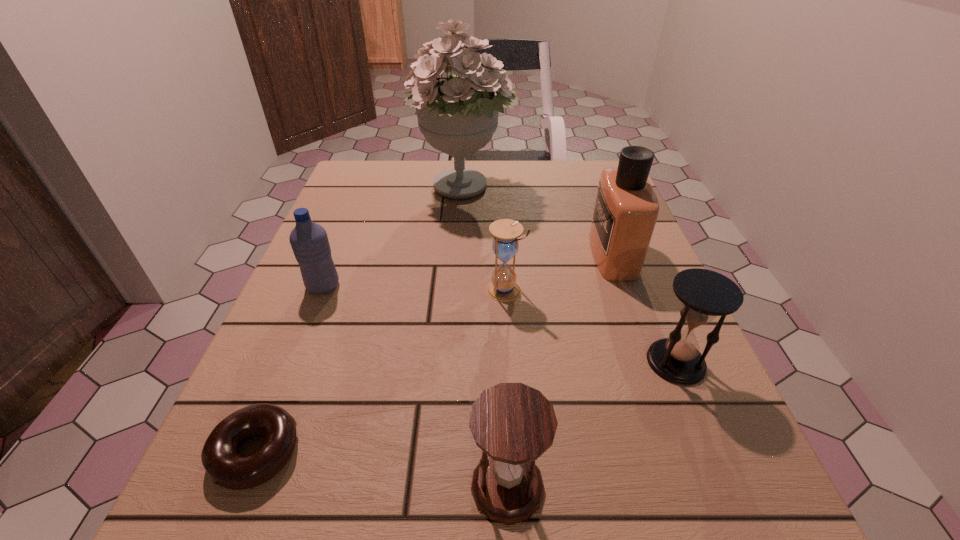
Where is `vacant space that satisfies the following two spatial constraints: 1. on the front label of the second nearest hourglass; 2. on the left side of the perfume`? This screenshot has width=960, height=540. vacant space that satisfies the following two spatial constraints: 1. on the front label of the second nearest hourglass; 2. on the left side of the perfume is located at coordinates (652, 362).

You are a GUI agent. You are given a task and a screenshot of the screen. Output one action in this format:
    pyautogui.click(x=<x>, y=<y>)
    Task: Click on the free space that satisfies the following two spatial constraints: 1. on the back side of the farthest hourglass; 2. on the left side of the shortest object
    
    Given the screenshot: What is the action you would take?
    pyautogui.click(x=321, y=290)